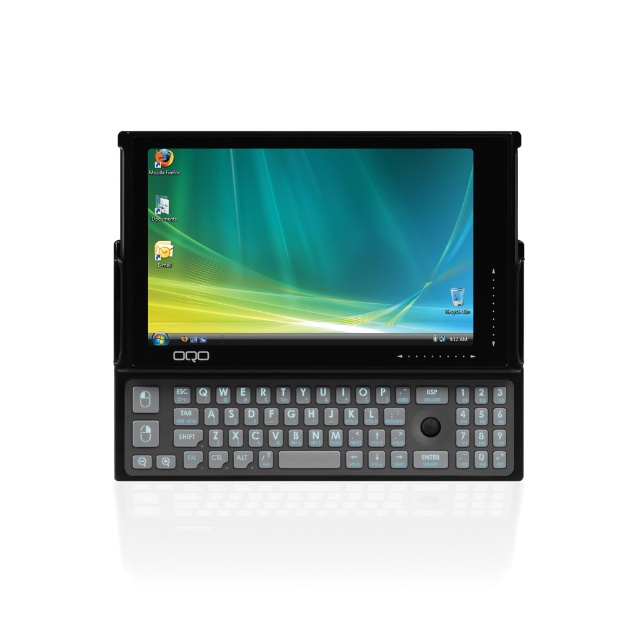
You are trying to locate the black plastic tablet at center in the image. What are the coordinates where you should look?

The black plastic tablet at center is located at coordinates point (317,305).

You are holding the black plastic tablet at center and the shiny plastic screen at center of a portable device. Which object is located to the left of the other?

The shiny plastic screen at center is located to the left of the black plastic tablet at center because the black plastic tablet at center is positioned on the right side of the shiny plastic screen at center.

You are holding the hybrid device and need to type a message. Which object should you use first, the black plastic tablet at center or the shiny plastic screen at center?

You should use the shiny plastic screen at center first because the black plastic tablet at center is located below it, meaning the screen is above and accessible for typing.